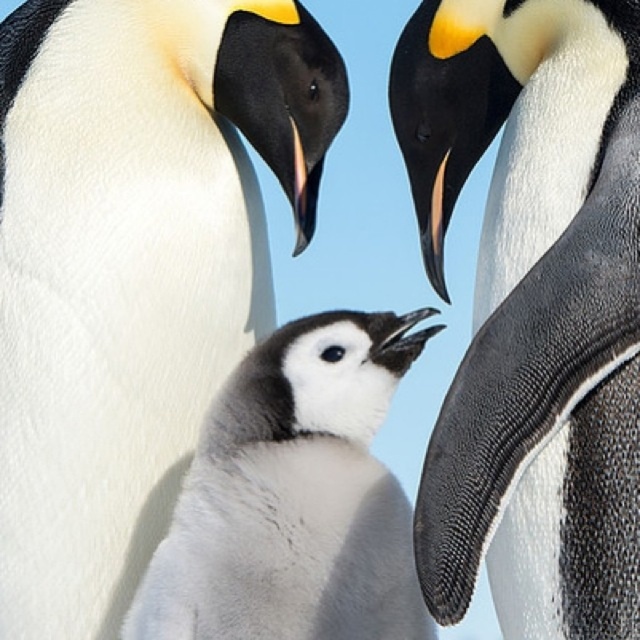
Describe the element at coordinates (532, 308) in the screenshot. I see `white matte penguin at center` at that location.

Consider the image. Does white matte penguin at center have a greater height compared to soft gray downy penguin chick at center?

Correct, white matte penguin at center is much taller as soft gray downy penguin chick at center.

Locate an element on the screen. white matte penguin at center is located at coordinates coord(532,308).

Does white matte penguin chick at center have a smaller size compared to soft gray downy penguin chick at center?

No.

Between point (115, 129) and point (269, 456), which one is positioned in front?

Positioned in front is point (269, 456).

Describe the element at coordinates (132, 266) in the screenshot. This screenshot has height=640, width=640. I see `white matte penguin chick at center` at that location.

You are a GUI agent. You are given a task and a screenshot of the screen. Output one action in this format:
    pyautogui.click(x=<x>, y=<y>)
    Task: Click on the white matte penguin chick at center
    The image size is (640, 640).
    Given the screenshot: What is the action you would take?
    pyautogui.click(x=132, y=266)

Who is higher up, white matte penguin chick at center or white matte penguin at center?

white matte penguin at center

Can you confirm if white matte penguin chick at center is positioned to the left of white matte penguin at center?

Indeed, white matte penguin chick at center is positioned on the left side of white matte penguin at center.

Who is more forward, (45, 154) or (598, 406)?

Point (598, 406) is more forward.

You are a GUI agent. You are given a task and a screenshot of the screen. Output one action in this format:
    pyautogui.click(x=<x>, y=<y>)
    Task: Click on the white matte penguin chick at center
    The width and height of the screenshot is (640, 640).
    Given the screenshot: What is the action you would take?
    pyautogui.click(x=132, y=266)